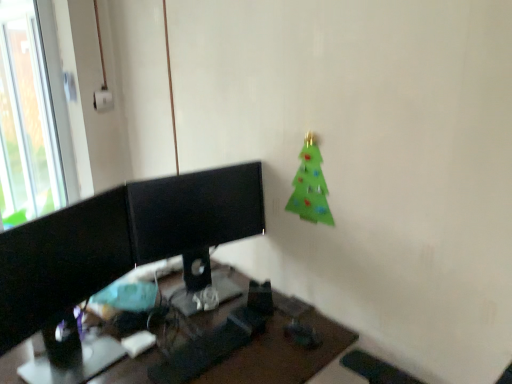
Question: From the image's perspective, is black plastic desk at center positioned above or below green felt christmas tree at upper right?

Choices:
 (A) below
 (B) above

Answer: (A)

Question: Is point (247, 375) positioned closer to the camera than point (309, 142)?

Choices:
 (A) farther
 (B) closer

Answer: (B)

Question: Which is farther from the black glossy monitor at center?

Choices:
 (A) transparent glass window at upper left
 (B) black glossy monitor at left
 (C) black plastic desk at center
 (D) green felt christmas tree at upper right

Answer: (A)

Question: Which is farther from the transparent glass window at upper left?

Choices:
 (A) black glossy monitor at left
 (B) green felt christmas tree at upper right
 (C) black plastic desk at center
 (D) black glossy monitor at center

Answer: (B)